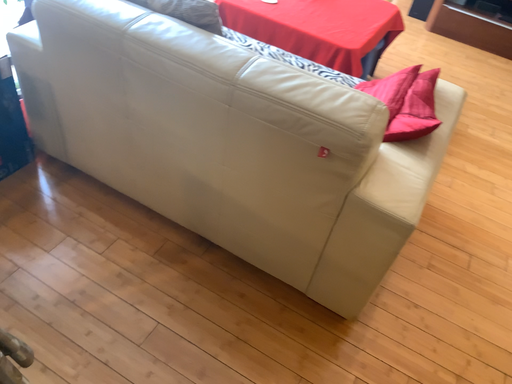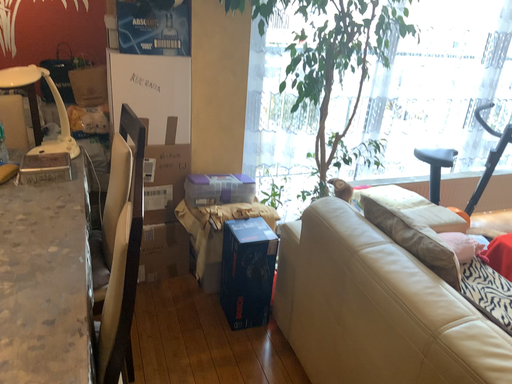
Question: Which way did the camera rotate in the video?

Choices:
 (A) rotated downward
 (B) rotated upward

Answer: (B)